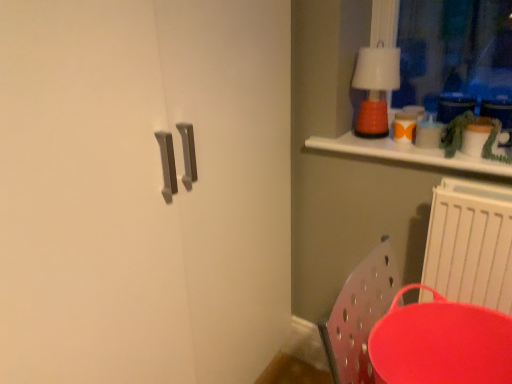
Question: In terms of size, does white plastic radiator at lower right appear bigger or smaller than orange matte lamp at upper right?

Choices:
 (A) small
 (B) big

Answer: (B)

Question: From the image's perspective, relative to orange matte lamp at upper right, is white plastic radiator at lower right above or below?

Choices:
 (A) below
 (B) above

Answer: (A)

Question: Considering the real-world distances, which object is farthest from the orange matte lamp at upper right?

Choices:
 (A) matte red tray at lower right
 (B) white plastic radiator at lower right

Answer: (A)

Question: Estimate the real-world distances between objects in this image. Which object is closer to the orange matte lamp at upper right?

Choices:
 (A) white plastic radiator at lower right
 (B) matte red tray at lower right

Answer: (A)